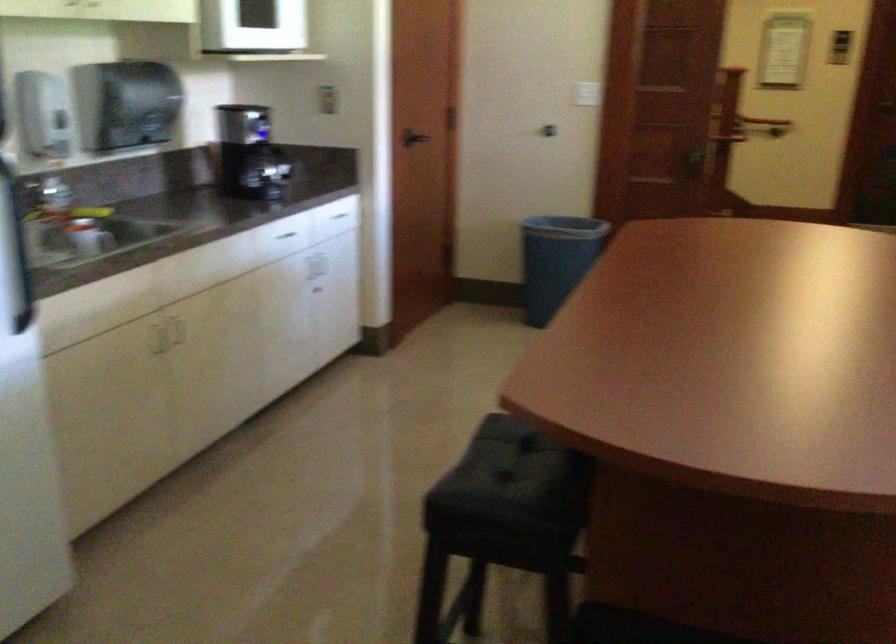
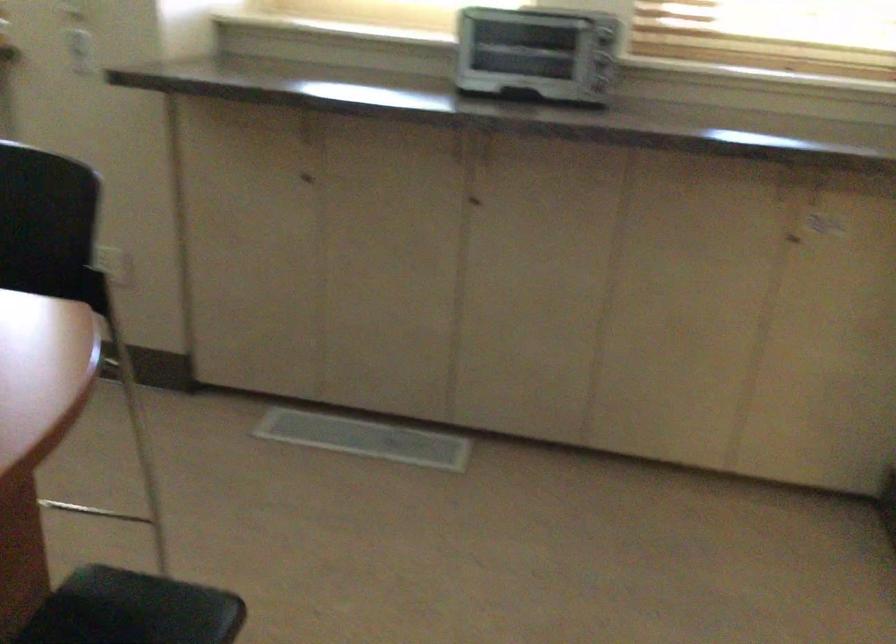
The first image is from the beginning of the video and the second image is from the end. How did the camera likely rotate when shooting the video?

The rotation direction of the camera is right-down.